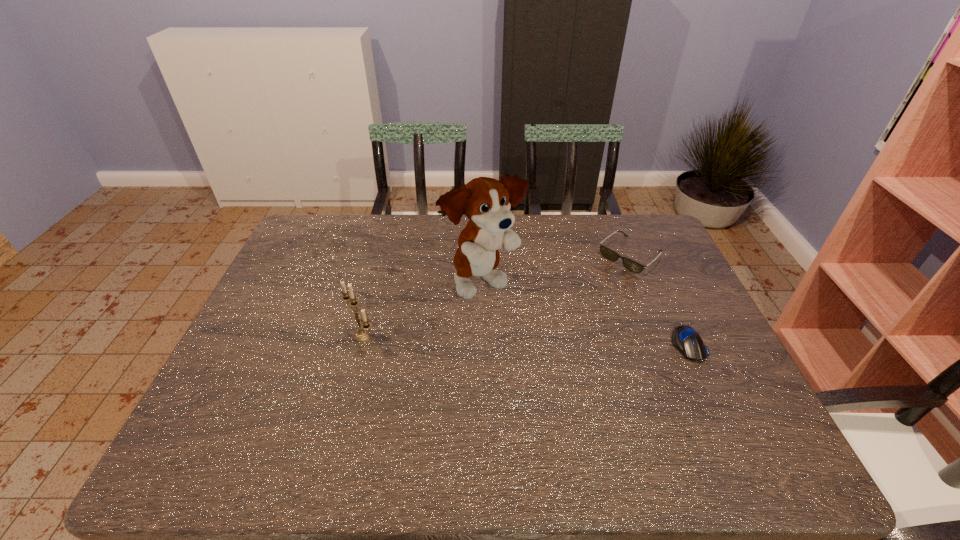
Image resolution: width=960 pixels, height=540 pixels. Identify the location of free space on the desktop that is between the third shortest object and the computer mouse and is positioned on the front-facing side of the second shortest object. (531, 340).

Locate an element on the screen. free space on the desktop that is between the candle and the computer mouse and is positioned on the face of the puppy is located at coordinates (572, 341).